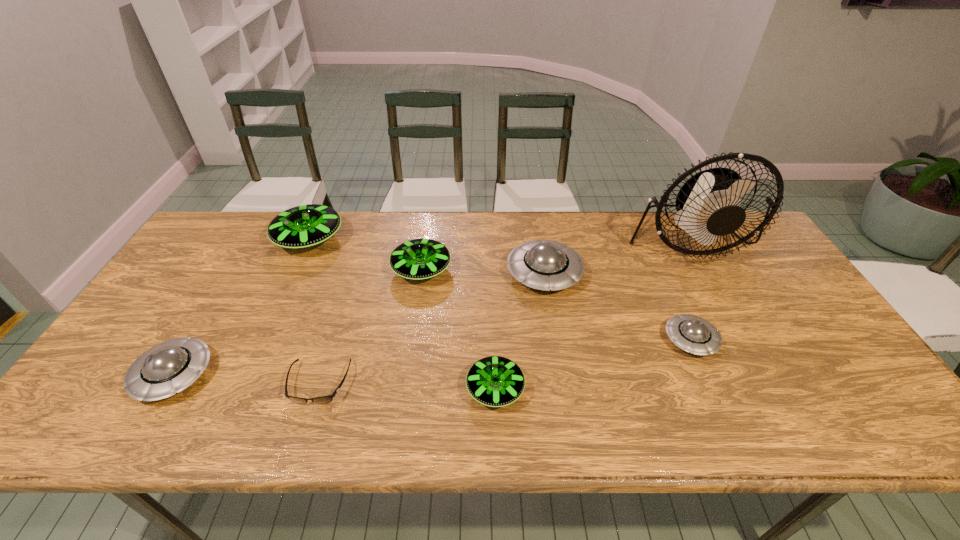
Where is `vacant space located on the left of the rightmost gray saucer`? vacant space located on the left of the rightmost gray saucer is located at coordinates (560, 340).

Locate an element on the screen. This screenshot has height=540, width=960. fan that is at the far edge is located at coordinates pos(708,204).

The width and height of the screenshot is (960, 540). In order to click on sunglasses that is at the near edge in this screenshot , I will do `click(324, 399)`.

You are a GUI agent. You are given a task and a screenshot of the screen. Output one action in this format:
    pyautogui.click(x=<x>, y=<y>)
    Task: Click on the object located at the left edge
    
    Given the screenshot: What is the action you would take?
    click(x=168, y=368)

Where is `object present at the right edge`? This screenshot has width=960, height=540. object present at the right edge is located at coordinates (708, 204).

This screenshot has height=540, width=960. Identify the location of object located at the near left corner. (168, 368).

This screenshot has height=540, width=960. Identify the location of object that is at the far right corner. [708, 204].

Identify the location of vacant space at the far edge. This screenshot has height=540, width=960. (436, 224).

The height and width of the screenshot is (540, 960). In order to click on blank space at the near edge of the desktop in this screenshot , I will do `click(245, 426)`.

In order to click on vacant region at the left edge of the desktop in this screenshot , I will do `click(199, 293)`.